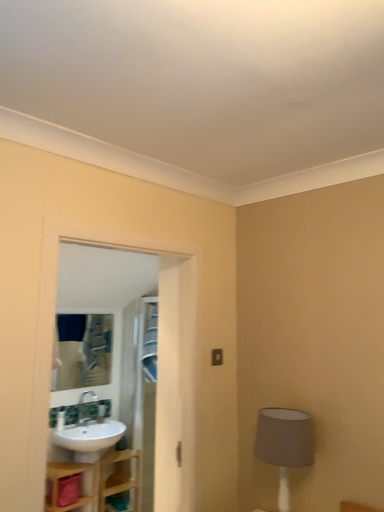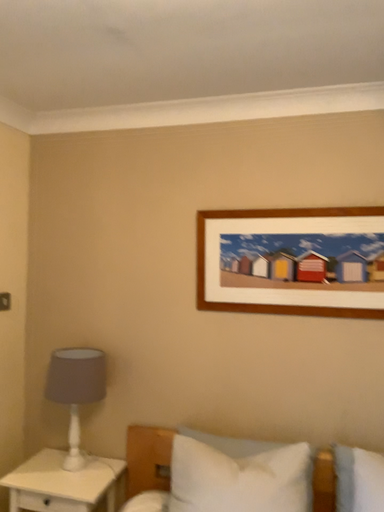
Question: How did the camera likely rotate when shooting the video?

Choices:
 (A) rotated downward
 (B) rotated upward

Answer: (A)